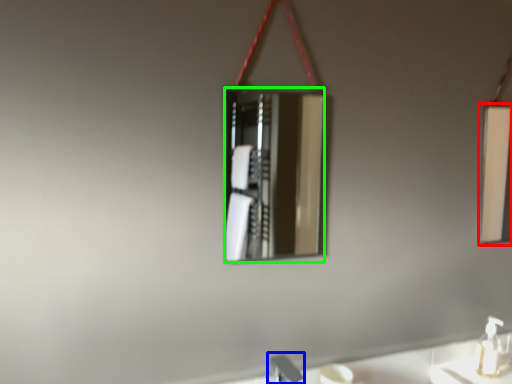
Question: Considering the real-world distances, which object is farthest from mirror (highlighted by a red box)? faucet (highlighted by a blue box) or mirror (highlighted by a green box)?

Choices:
 (A) faucet
 (B) mirror

Answer: (A)